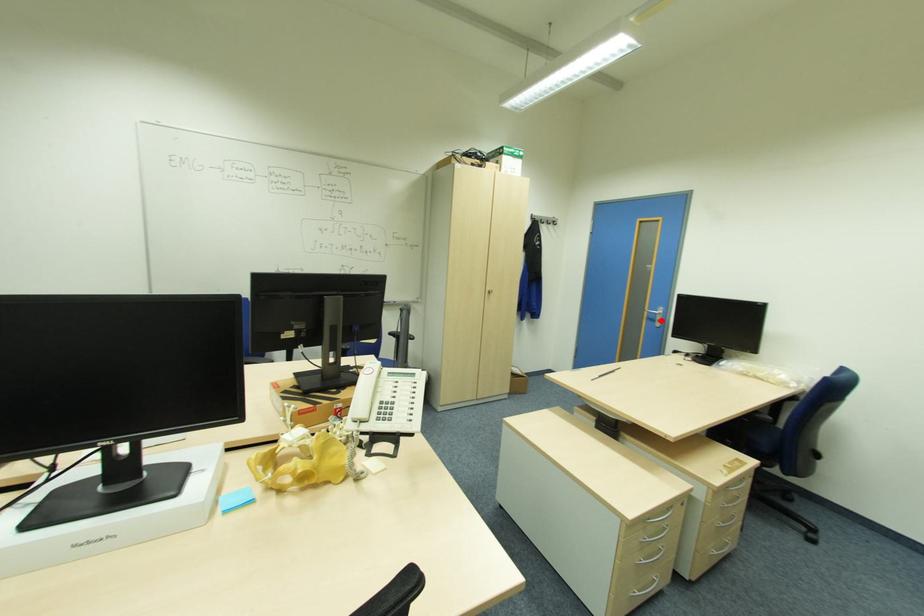
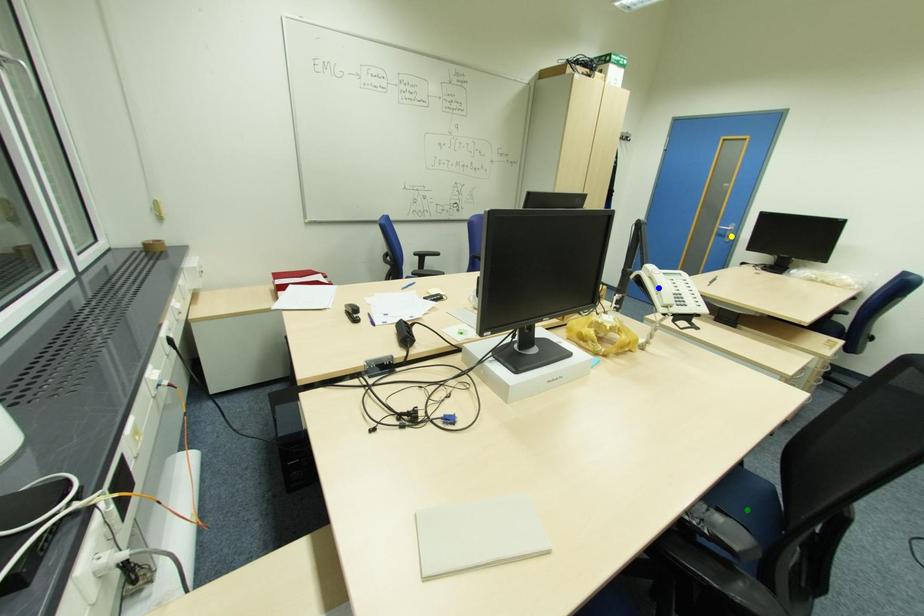
Question: I am providing you with two images of the same scene from different viewpoints. A red point is marked on the first image. You are given multiple points on the second image. Can you choose the point in image 2 that corresponds to the point in image 1?

Choices:
 (A) green point
 (B) yellow point
 (C) blue point

Answer: (B)